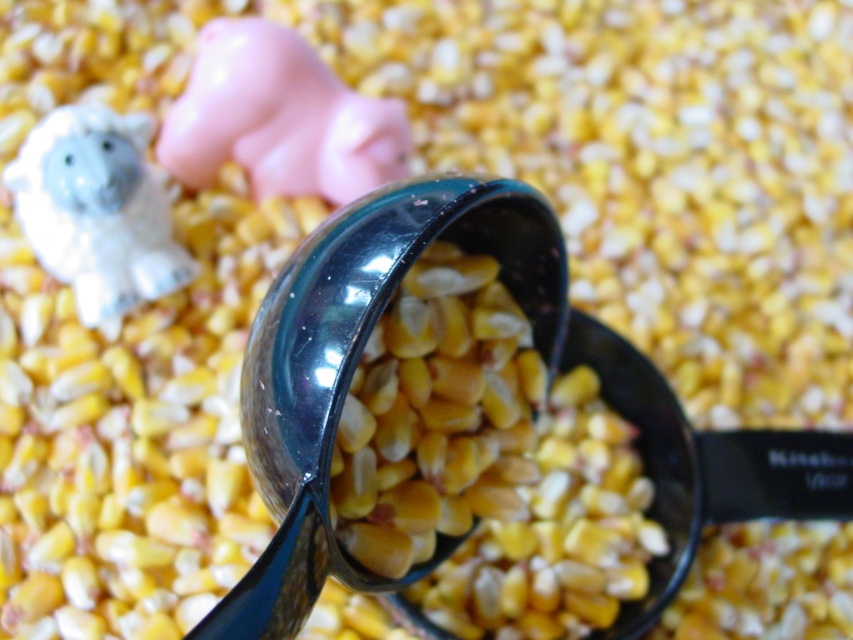
Between pink rubber pig at upper center and white glossy figurine at upper left, which one appears on the right side from the viewer's perspective?

From the viewer's perspective, pink rubber pig at upper center appears more on the right side.

Between point (289, 88) and point (82, 292), which one is positioned in front?

Positioned in front is point (82, 292).

Find the location of a particular element. pink rubber pig at upper center is located at coordinates (279, 118).

You are a GUI agent. You are given a task and a screenshot of the screen. Output one action in this format:
    pyautogui.click(x=<x>, y=<y>)
    Task: Click on the pink rubber pig at upper center
    
    Given the screenshot: What is the action you would take?
    pyautogui.click(x=279, y=118)